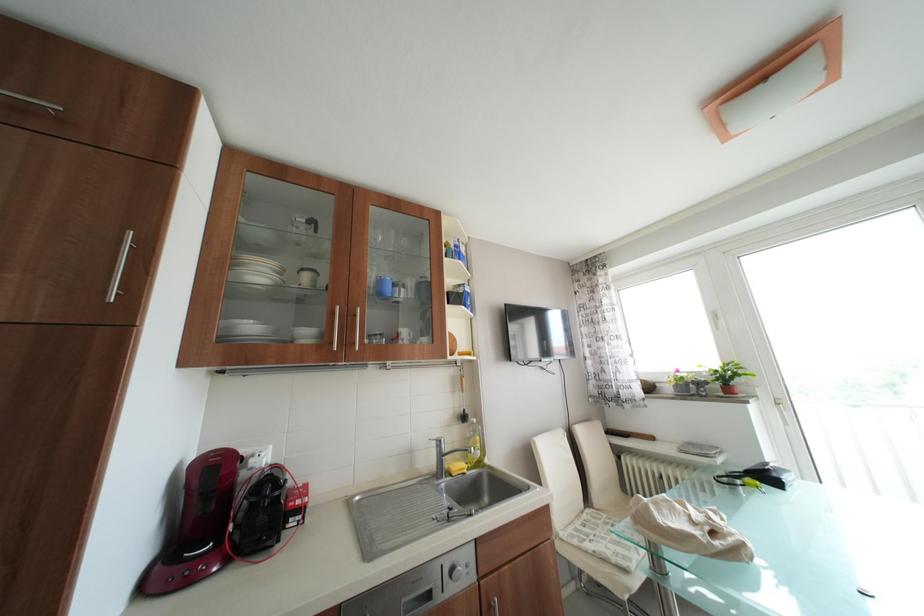
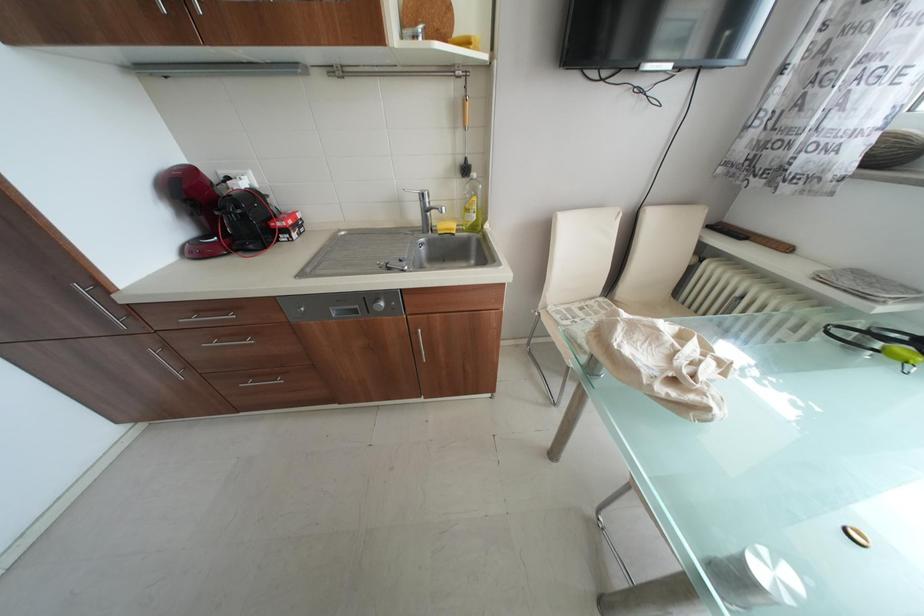
Based on the continuous images, in which direction is the camera rotating?

The camera rotated toward left-down.